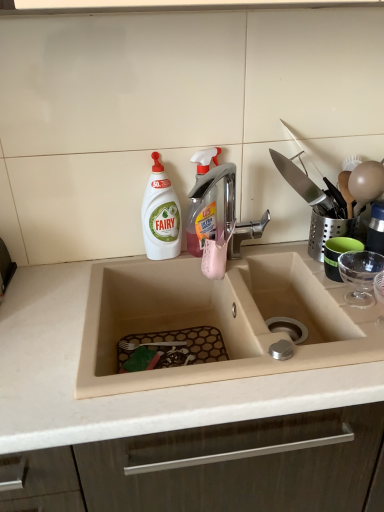
Question: Is beige matte sink at center positioned before white plastic bottle at upper left, which is counted as the second cleaning product, starting from the right?

Choices:
 (A) yes
 (B) no

Answer: (A)

Question: From a real-world perspective, is beige matte sink at center over white plastic bottle at upper left, which is counted as the second cleaning product, starting from the right?

Choices:
 (A) yes
 (B) no

Answer: (B)

Question: Does beige matte sink at center lie behind white plastic bottle at upper left, which is counted as the second cleaning product, starting from the right?

Choices:
 (A) yes
 (B) no

Answer: (B)

Question: Is beige matte sink at center looking in the opposite direction of white plastic bottle at upper left, positioned as the first cleaning product in left-to-right order?

Choices:
 (A) yes
 (B) no

Answer: (B)

Question: Can you confirm if beige matte sink at center is thinner than white plastic bottle at upper left, which is counted as the second cleaning product, starting from the right?

Choices:
 (A) no
 (B) yes

Answer: (A)

Question: Is beige matte sink at center positioned far away from white plastic bottle at upper left, positioned as the first cleaning product in left-to-right order?

Choices:
 (A) no
 (B) yes

Answer: (A)

Question: Is white plastic bottle at upper left, which is counted as the second cleaning product, starting from the right, positioned far away from translucent plastic spray bottle at upper center, marked as the 2th cleaning product in a left-to-right arrangement?

Choices:
 (A) yes
 (B) no

Answer: (B)

Question: Is white plastic bottle at upper left, positioned as the first cleaning product in left-to-right order, shorter than translucent plastic spray bottle at upper center, acting as the 1th cleaning product starting from the right?

Choices:
 (A) no
 (B) yes

Answer: (A)

Question: Is white plastic bottle at upper left, which is counted as the second cleaning product, starting from the right, beside translucent plastic spray bottle at upper center, marked as the 2th cleaning product in a left-to-right arrangement?

Choices:
 (A) yes
 (B) no

Answer: (A)

Question: Considering the relative positions of white plastic bottle at upper left, which is counted as the second cleaning product, starting from the right, and translucent plastic spray bottle at upper center, acting as the 1th cleaning product starting from the right, in the image provided, is white plastic bottle at upper left, which is counted as the second cleaning product, starting from the right, to the left of translucent plastic spray bottle at upper center, acting as the 1th cleaning product starting from the right, from the viewer's perspective?

Choices:
 (A) no
 (B) yes

Answer: (B)

Question: Is white plastic bottle at upper left, positioned as the first cleaning product in left-to-right order, thinner than translucent plastic spray bottle at upper center, acting as the 1th cleaning product starting from the right?

Choices:
 (A) yes
 (B) no

Answer: (B)

Question: Can we say white plastic bottle at upper left, which is counted as the second cleaning product, starting from the right, lies outside translucent plastic spray bottle at upper center, marked as the 2th cleaning product in a left-to-right arrangement?

Choices:
 (A) yes
 (B) no

Answer: (A)

Question: Considering the relative sizes of white plastic bottle at upper left, positioned as the first cleaning product in left-to-right order, and beige matte sink at center in the image provided, is white plastic bottle at upper left, positioned as the first cleaning product in left-to-right order, taller than beige matte sink at center?

Choices:
 (A) yes
 (B) no

Answer: (A)